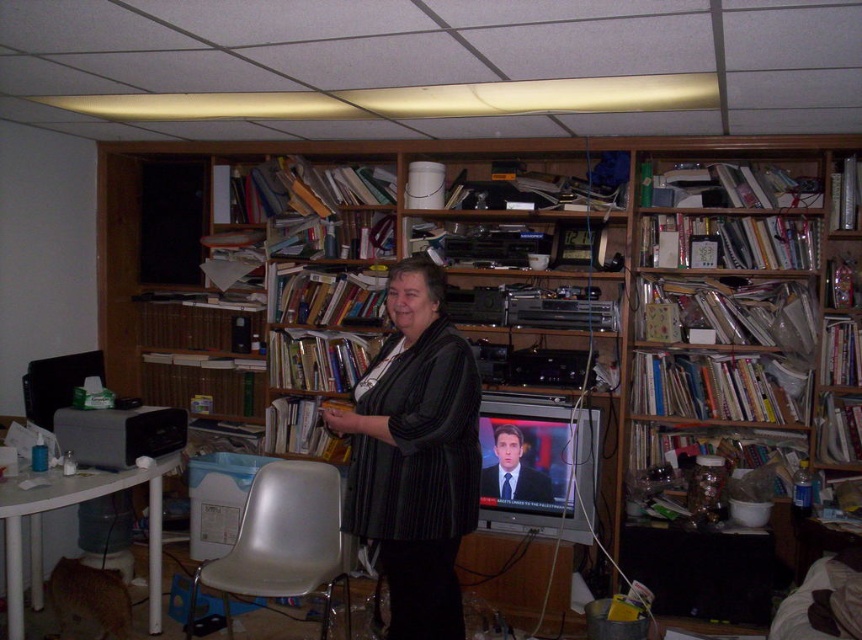
Can you confirm if black textured sweater at center is thinner than blue suit at center?

No.

You are a GUI agent. You are given a task and a screenshot of the screen. Output one action in this format:
    pyautogui.click(x=<x>, y=<y>)
    Task: Click on the black textured sweater at center
    The width and height of the screenshot is (862, 640).
    Given the screenshot: What is the action you would take?
    click(415, 454)

Identify the location of black textured sweater at center. (415, 454).

Which is behind, point (361, 465) or point (267, 540)?

Positioned behind is point (267, 540).

The width and height of the screenshot is (862, 640). What do you see at coordinates (415, 454) in the screenshot?
I see `black textured sweater at center` at bounding box center [415, 454].

This screenshot has width=862, height=640. Identify the location of black textured sweater at center. (415, 454).

Can you confirm if white plastic chair at lower center is bigger than blue suit at center?

Yes.

This screenshot has height=640, width=862. Find the location of `white plastic chair at lower center`. white plastic chair at lower center is located at coordinates (282, 541).

Identify the location of white plastic chair at lower center. (282, 541).